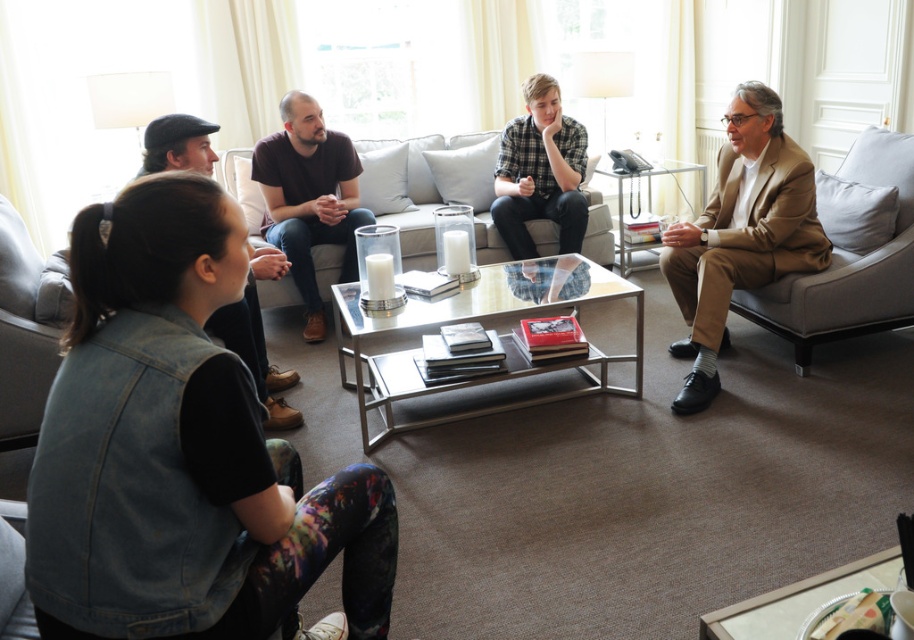
Question: Does dark brown t-shirt at center come behind denim vest at lower left?

Choices:
 (A) yes
 (B) no

Answer: (A)

Question: Is light gray fabric armchair at right to the right of plaid shirt at center from the viewer's perspective?

Choices:
 (A) yes
 (B) no

Answer: (A)

Question: Based on their relative distances, which object is farther from the light gray fabric armchair at right?

Choices:
 (A) dark brown t-shirt at center
 (B) denim vest at lower left
 (C) plaid shirt at center

Answer: (B)

Question: Which object is farther from the camera taking this photo?

Choices:
 (A) light brown suit at right
 (B) light gray fabric couch at center
 (C) dark brown t-shirt at center

Answer: (B)

Question: Is light brown suit at right to the right of light gray fabric couch at center from the viewer's perspective?

Choices:
 (A) yes
 (B) no

Answer: (A)

Question: Among these points, which one is farthest from the camera?

Choices:
 (A) (713, 244)
 (B) (902, 289)
 (C) (516, 122)

Answer: (C)